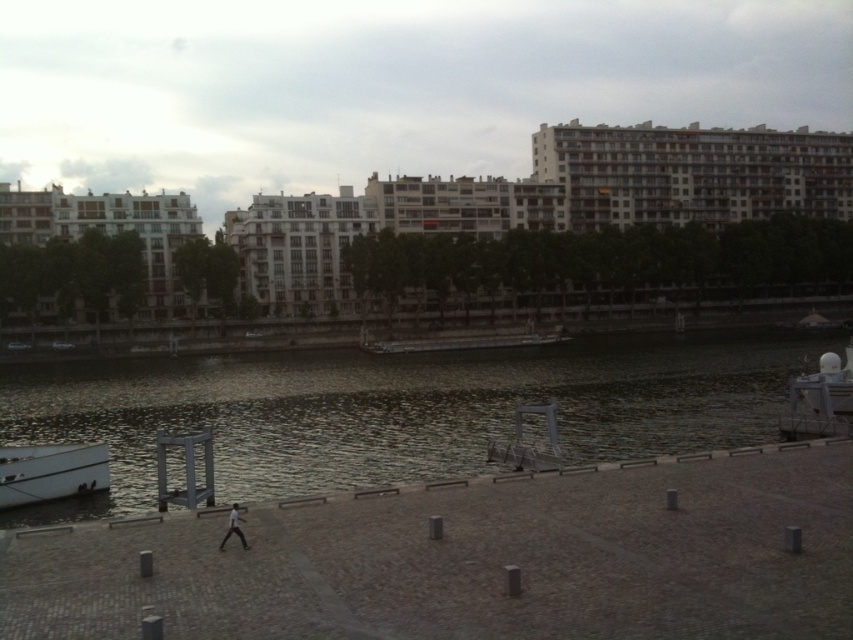
Which is above, dark water at center or white matte boat at lower left?

dark water at center is higher up.

Between dark water at center and white matte boat at lower left, which one is positioned lower?

white matte boat at lower left

Between point (749, 365) and point (90, 484), which one is positioned in front?

Point (90, 484) is in front.

This screenshot has width=853, height=640. What are the coordinates of `dark water at center` in the screenshot? It's located at (399, 410).